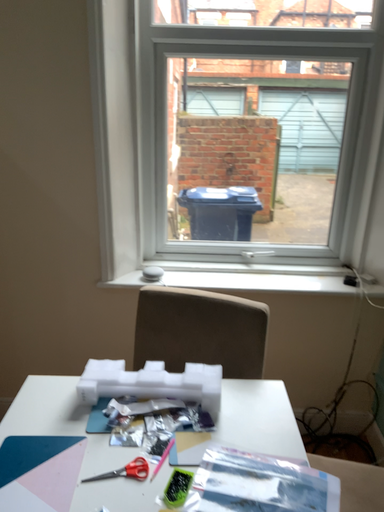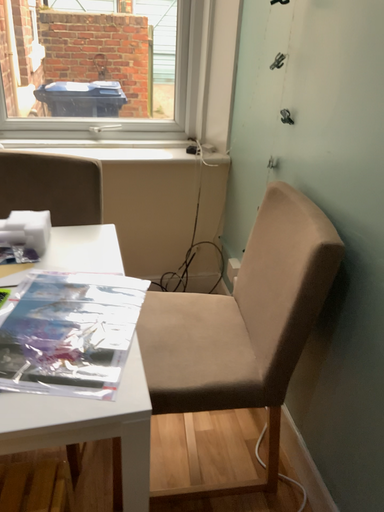
Question: Which way did the camera rotate in the video?

Choices:
 (A) rotated left
 (B) rotated right

Answer: (B)